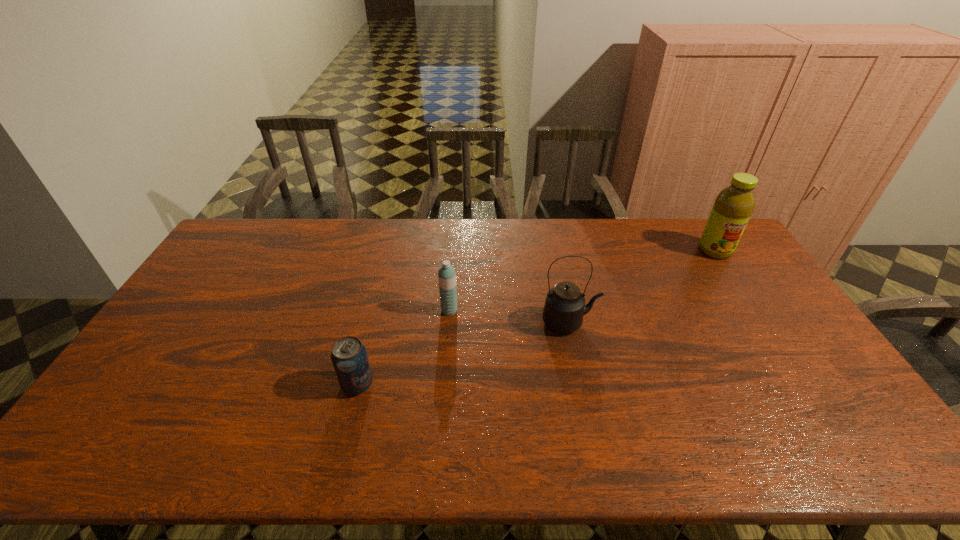
Identify the location of free location located 0.070m on the right of the pop soda. Image resolution: width=960 pixels, height=540 pixels. (400, 384).

Identify the location of object that is at the far edge. This screenshot has height=540, width=960. (733, 206).

I want to click on object that is at the right edge, so click(x=733, y=206).

The width and height of the screenshot is (960, 540). What are the coordinates of `object situated at the far right corner` in the screenshot? It's located at (733, 206).

Identify the location of vacant area at the far edge of the desktop. point(590,222).

In the image, there is a desktop. Where is `vacant space at the near edge`? vacant space at the near edge is located at coordinates (509, 438).

In the image, there is a desktop. Where is `vacant space at the left edge`? The height and width of the screenshot is (540, 960). vacant space at the left edge is located at coordinates (156, 422).

This screenshot has width=960, height=540. What are the coordinates of `free location at the right edge` in the screenshot? It's located at (850, 413).

At what (x,y) coordinates should I click in order to perform the action: click on vacant space at the near left corner. Please return your answer as a coordinate pair (x, y). This screenshot has height=540, width=960. Looking at the image, I should click on (119, 436).

The height and width of the screenshot is (540, 960). Identify the location of free point between the third tallest object and the pop soda. (403, 347).